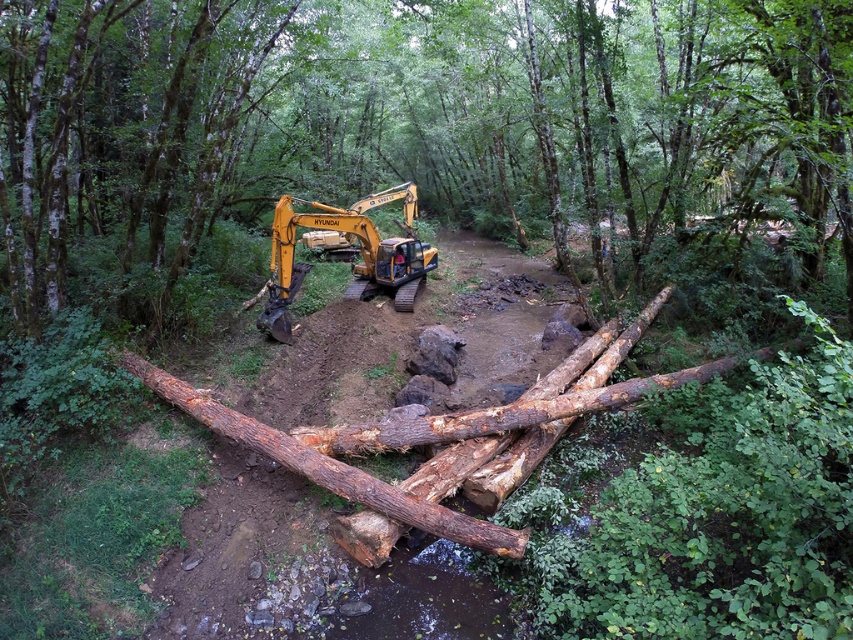
This screenshot has height=640, width=853. In order to click on rough wooden log at center in this screenshot , I will do coord(419,122).

The width and height of the screenshot is (853, 640). Find the location of `rough wooden log at center`. rough wooden log at center is located at coordinates (419, 122).